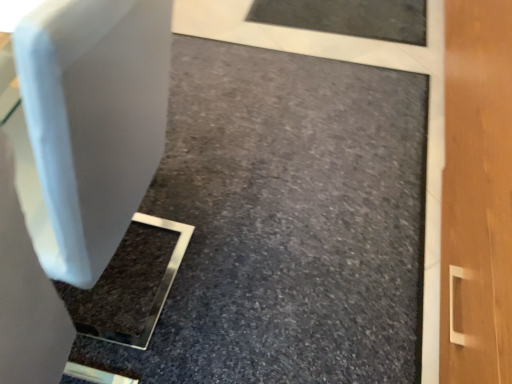
This screenshot has width=512, height=384. What do you see at coordinates (88, 125) in the screenshot?
I see `white plastic swivel chair at left` at bounding box center [88, 125].

Locate an element on the screen. white plastic swivel chair at left is located at coordinates (88, 125).

Describe the element at coordinates (286, 222) in the screenshot. The image size is (512, 384). I see `matte white concrete at center` at that location.

Locate an element on the screen. The width and height of the screenshot is (512, 384). matte white concrete at center is located at coordinates (286, 222).

Identify the location of white plastic swivel chair at left. (88, 125).

Would you say matte white concrete at center is to the left or to the right of white plastic swivel chair at left in the picture?

matte white concrete at center is positioned on white plastic swivel chair at left's right side.

Which is behind, matte white concrete at center or white plastic swivel chair at left?

matte white concrete at center is further away from the camera.

Which is less distant, (148, 270) or (143, 155)?

Point (148, 270).

From the image's perspective, is matte white concrete at center above or below white plastic swivel chair at left?

matte white concrete at center is below white plastic swivel chair at left.

From a real-world perspective, who is located lower, matte white concrete at center or white plastic swivel chair at left?

matte white concrete at center, from a real-world perspective.

In terms of width, does matte white concrete at center look wider or thinner when compared to white plastic swivel chair at left?

Clearly, matte white concrete at center has more width compared to white plastic swivel chair at left.

Considering the sizes of matte white concrete at center and white plastic swivel chair at left in the image, is matte white concrete at center taller or shorter than white plastic swivel chair at left?

matte white concrete at center is shorter than white plastic swivel chair at left.

In terms of size, does matte white concrete at center appear bigger or smaller than white plastic swivel chair at left?

Clearly, matte white concrete at center is smaller in size than white plastic swivel chair at left.

Is white plastic swivel chair at left completely or partially inside matte white concrete at center?

That's incorrect, white plastic swivel chair at left is not inside matte white concrete at center.

Is matte white concrete at center not near white plastic swivel chair at left?

No.

Is white plastic swivel chair at left at the back of matte white concrete at center?

No, matte white concrete at center's orientation is not away from white plastic swivel chair at left.

Find the location of a particular element. concrete lying on the right of white plastic swivel chair at left is located at coordinates (286, 222).

Does white plastic swivel chair at left appear on the right side of matte white concrete at center?

In fact, white plastic swivel chair at left is to the left of matte white concrete at center.

Which object is further away from the camera taking this photo, white plastic swivel chair at left or matte white concrete at center?

matte white concrete at center.

Based on the photo, which is closer to the camera, (x=99, y=190) or (x=380, y=117)?

Point (x=99, y=190) is closer to the camera than point (x=380, y=117).

From the image's perspective, which is below, white plastic swivel chair at left or matte white concrete at center?

matte white concrete at center is shown below in the image.

From a real-world perspective, is white plastic swivel chair at left positioned over matte white concrete at center based on gravity?

Correct, in the physical world, white plastic swivel chair at left is higher than matte white concrete at center.

Is white plastic swivel chair at left wider than matte white concrete at center?

Incorrect, the width of white plastic swivel chair at left does not surpass that of matte white concrete at center.

Consider the image. In terms of height, does white plastic swivel chair at left look taller or shorter compared to matte white concrete at center?

Considering their sizes, white plastic swivel chair at left has more height than matte white concrete at center.

Considering the relative sizes of white plastic swivel chair at left and matte white concrete at center in the image provided, is white plastic swivel chair at left bigger than matte white concrete at center?

Indeed, white plastic swivel chair at left has a larger size compared to matte white concrete at center.

Is white plastic swivel chair at left spatially inside matte white concrete at center, or outside of it?

white plastic swivel chair at left exists outside the volume of matte white concrete at center.

Would you say white plastic swivel chair at left is a long distance from matte white concrete at center?

white plastic swivel chair at left is actually quite close to matte white concrete at center.

Is white plastic swivel chair at left facing away from matte white concrete at center?

No.

Image resolution: width=512 pixels, height=384 pixels. I want to click on concrete located below the white plastic swivel chair at left (from the image's perspective), so click(286, 222).

I want to click on concrete below the white plastic swivel chair at left (from a real-world perspective), so click(x=286, y=222).

Find the location of a particular element. This screenshot has height=384, width=512. swivel chair lying on the left of matte white concrete at center is located at coordinates (88, 125).